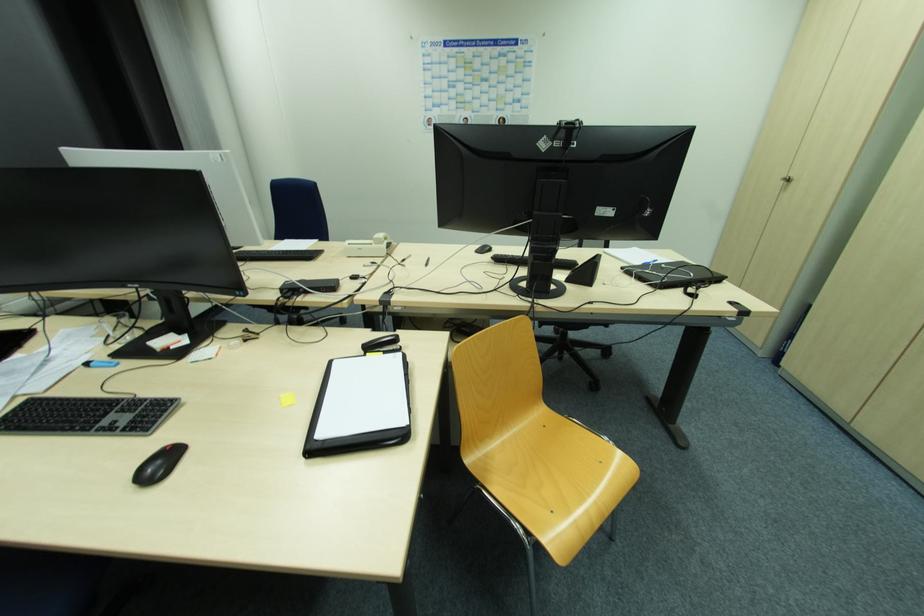
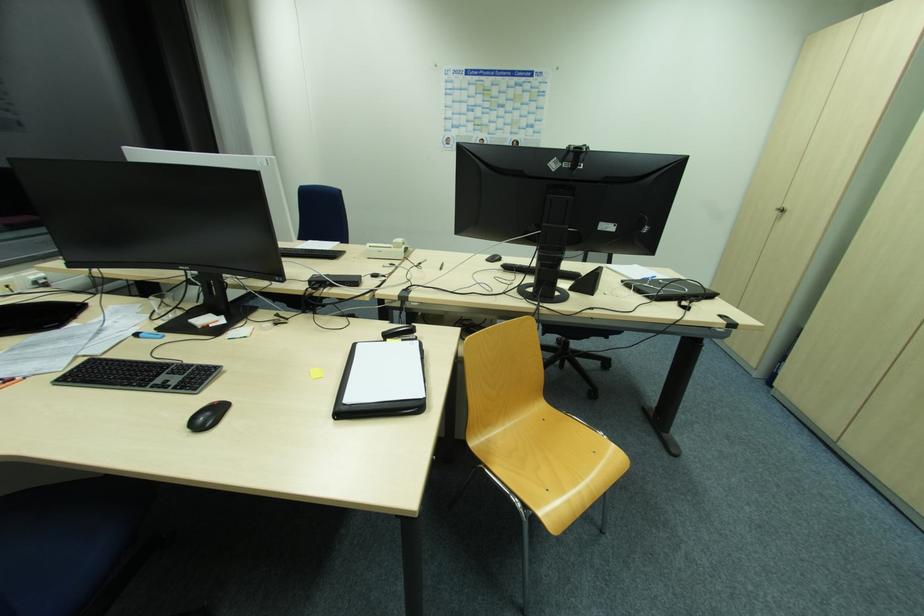
Find the pixel in the second image that matches pixel 784 183 in the first image.

(779, 214)